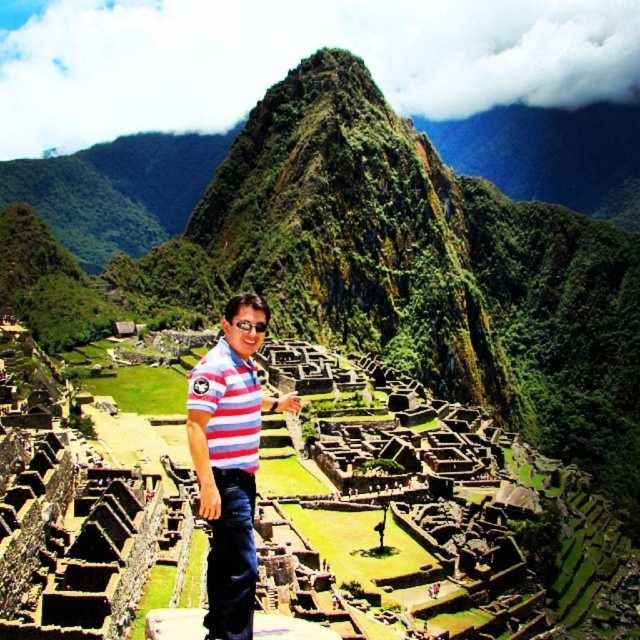
Is striped cotton shirt at center further to camera compared to striped cotton polo shirt at center?

No.

Does striped cotton shirt at center appear on the right side of striped cotton polo shirt at center?

Yes, striped cotton shirt at center is to the right of striped cotton polo shirt at center.

Is point (248, 499) farther from camera compared to point (232, 396)?

No, it is in front of (232, 396).

At what (x,y) coordinates should I click in order to perform the action: click on striped cotton shirt at center. Please return your answer as a coordinate pair (x, y). This screenshot has width=640, height=640. Looking at the image, I should click on (230, 460).